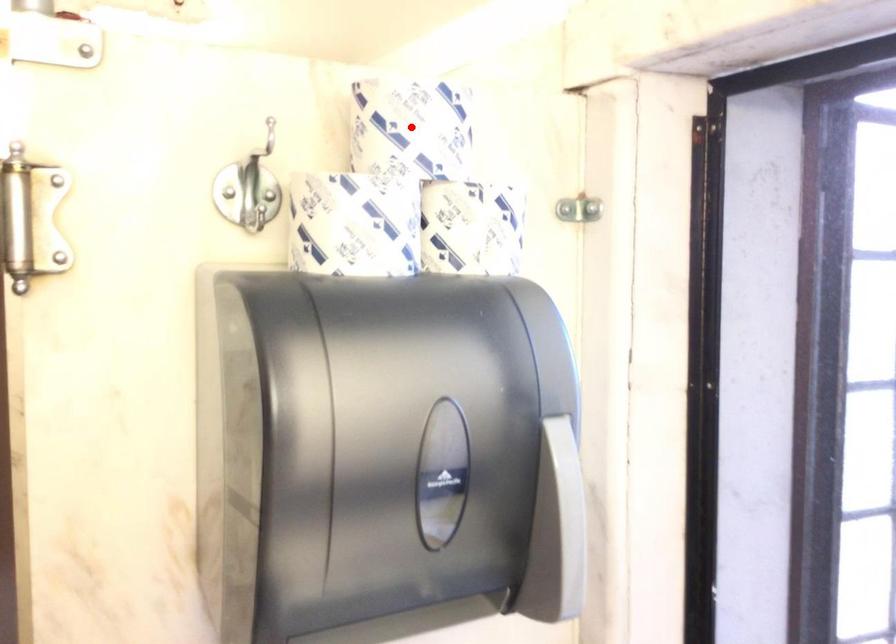
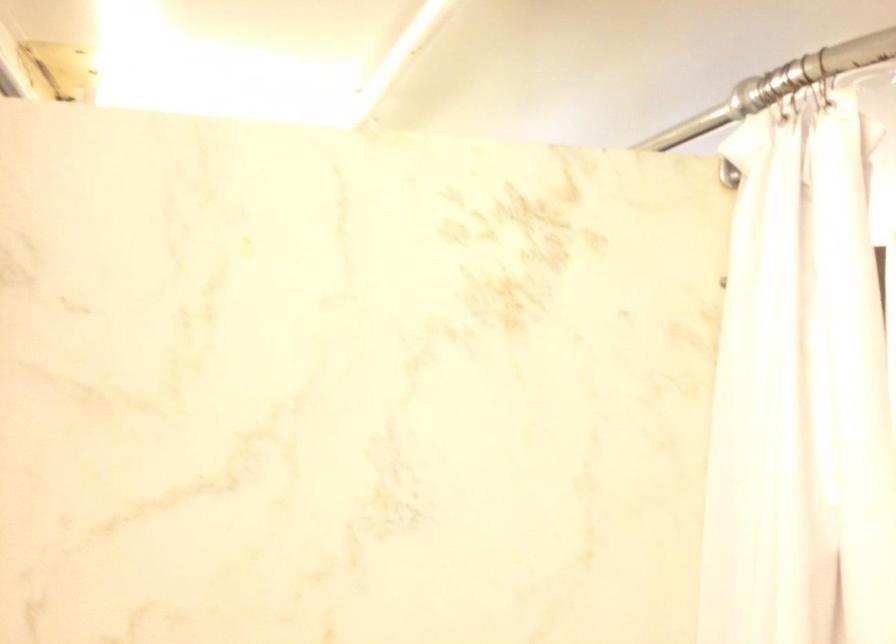
Question: I am providing you with two images of the same scene from different viewpoints. A red point is marked on the first image. At the location where the point appears in image 1, is it still visible in image 2?

Choices:
 (A) Yes
 (B) No

Answer: (B)